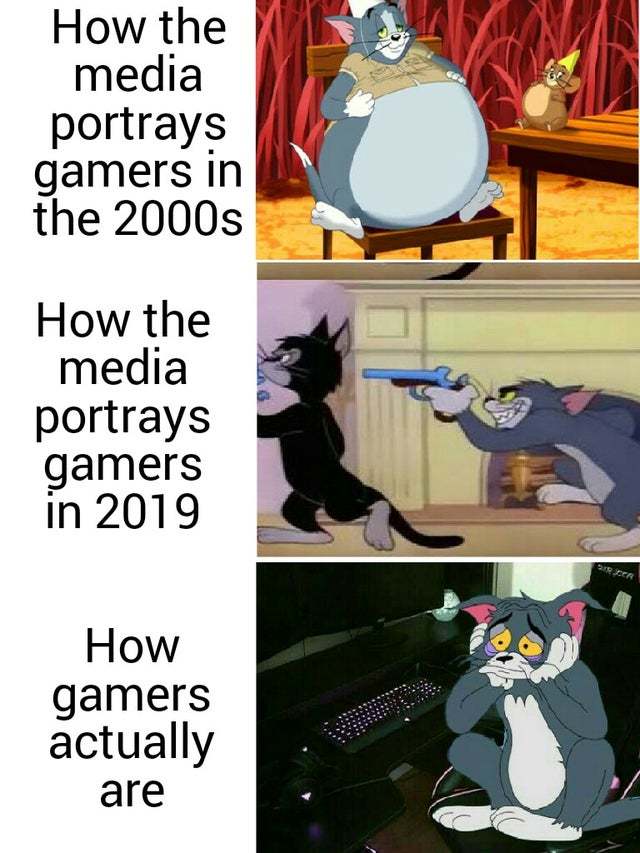
I want to click on fireplace, so click(505, 344).